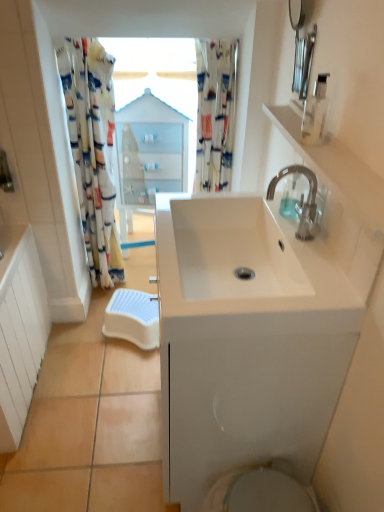
Question: Is transparent plastic soap dispenser at upper right, the 1th soap dispenser in the front-to-back sequence, located outside printed fabric shower curtain at upper center, acting as the 2th shower curtain starting from the left?

Choices:
 (A) yes
 (B) no

Answer: (A)

Question: Is printed fabric shower curtain at upper center, which ranks as the 1th shower curtain in right-to-left order, inside transparent plastic soap dispenser at upper right, arranged as the 2th soap dispenser when ordered from the bottom?

Choices:
 (A) yes
 (B) no

Answer: (B)

Question: Does transparent plastic soap dispenser at upper right, the 1th soap dispenser in the front-to-back sequence, have a lesser height compared to printed fabric shower curtain at upper center, acting as the 2th shower curtain starting from the left?

Choices:
 (A) yes
 (B) no

Answer: (A)

Question: Considering the relative positions of transparent plastic soap dispenser at upper right, placed as the second soap dispenser when sorted from back to front, and printed fabric shower curtain at upper center, which ranks as the 1th shower curtain in right-to-left order, in the image provided, is transparent plastic soap dispenser at upper right, placed as the second soap dispenser when sorted from back to front, to the right of printed fabric shower curtain at upper center, which ranks as the 1th shower curtain in right-to-left order, from the viewer's perspective?

Choices:
 (A) no
 (B) yes

Answer: (B)

Question: Could you tell me if transparent plastic soap dispenser at upper right, placed as the second soap dispenser when sorted from back to front, is turned towards printed fabric shower curtain at upper center, which ranks as the 1th shower curtain in right-to-left order?

Choices:
 (A) yes
 (B) no

Answer: (B)

Question: Can you confirm if transparent plastic soap dispenser at upper right, arranged as the 2th soap dispenser when ordered from the bottom, is thinner than printed fabric shower curtain at upper center, which ranks as the 1th shower curtain in right-to-left order?

Choices:
 (A) yes
 (B) no

Answer: (A)

Question: Is floral fabric shower curtain at left, which appears as the second shower curtain when viewed from the right, far from white plastic step stool at lower center?

Choices:
 (A) yes
 (B) no

Answer: (B)

Question: From the image's perspective, is floral fabric shower curtain at left, which appears as the second shower curtain when viewed from the right, beneath white plastic step stool at lower center?

Choices:
 (A) no
 (B) yes

Answer: (A)

Question: From a real-world perspective, is floral fabric shower curtain at left, which appears as the 1th shower curtain when viewed from the left, beneath white plastic step stool at lower center?

Choices:
 (A) no
 (B) yes

Answer: (A)

Question: Does floral fabric shower curtain at left, which appears as the 1th shower curtain when viewed from the left, have a greater width compared to white plastic step stool at lower center?

Choices:
 (A) no
 (B) yes

Answer: (A)

Question: Does floral fabric shower curtain at left, which appears as the second shower curtain when viewed from the right, lie behind white plastic step stool at lower center?

Choices:
 (A) no
 (B) yes

Answer: (A)

Question: Is floral fabric shower curtain at left, which appears as the second shower curtain when viewed from the right, oriented towards white plastic step stool at lower center?

Choices:
 (A) no
 (B) yes

Answer: (B)

Question: From the image's perspective, is white plastic step stool at lower center on top of white glossy cabinet at center?

Choices:
 (A) yes
 (B) no

Answer: (B)